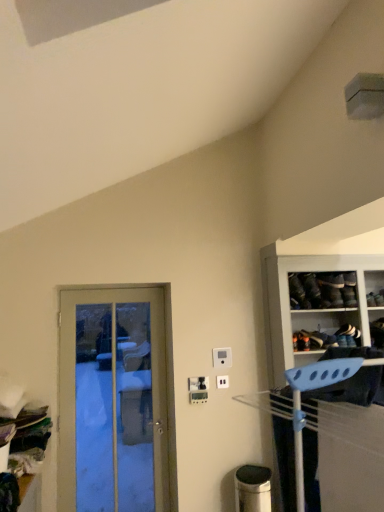
Question: Is white leather shoe at upper right, acting as the 1th shoe starting from the right, facing away from blue plastic hanger at right?

Choices:
 (A) yes
 (B) no

Answer: (B)

Question: Is white leather shoe at upper right, which is the first shoe from bottom to top, far from blue plastic hanger at right?

Choices:
 (A) yes
 (B) no

Answer: (B)

Question: Does white leather shoe at upper right, acting as the 1th shoe starting from the right, come behind blue plastic hanger at right?

Choices:
 (A) no
 (B) yes

Answer: (B)

Question: Is white leather shoe at upper right, acting as the 1th shoe starting from the right, with blue plastic hanger at right?

Choices:
 (A) yes
 (B) no

Answer: (B)

Question: From a real-world perspective, is white leather shoe at upper right, which is the 2th shoe in top-to-bottom order, physically below blue plastic hanger at right?

Choices:
 (A) no
 (B) yes

Answer: (A)

Question: In terms of height, does wooden door at left look taller or shorter compared to white plastic electric outlet at center, the first electric outlet from the top?

Choices:
 (A) tall
 (B) short

Answer: (A)

Question: From a real-world perspective, is wooden door at left above or below white plastic electric outlet at center, the first electric outlet from the top?

Choices:
 (A) above
 (B) below

Answer: (B)

Question: Is wooden door at left wider or thinner than white plastic electric outlet at center, which is the third electric outlet in bottom-to-top order?

Choices:
 (A) wide
 (B) thin

Answer: (A)

Question: From the image's perspective, is wooden door at left above or below white plastic electric outlet at center, which is the third electric outlet in bottom-to-top order?

Choices:
 (A) above
 (B) below

Answer: (B)

Question: Is point pyautogui.click(x=311, y=352) positioned closer to the camera than point pyautogui.click(x=201, y=388)?

Choices:
 (A) closer
 (B) farther

Answer: (A)

Question: Is blue plastic hanger at right wider or thinner than white plastic electric outlet at center, the 2th electric outlet positioned from the bottom?

Choices:
 (A) wide
 (B) thin

Answer: (A)

Question: Is blue plastic hanger at right situated inside white plastic electric outlet at center, the 2th electric outlet positioned from the bottom, or outside?

Choices:
 (A) outside
 (B) inside

Answer: (A)

Question: From a real-world perspective, is blue plastic hanger at right above or below white plastic electric outlet at center, the 2th electric outlet viewed from the top?

Choices:
 (A) above
 (B) below

Answer: (A)

Question: Relative to blue plastic hanger at right, is white plastic electric outlet at center, the 2th electric outlet positioned from the bottom, in front or behind?

Choices:
 (A) behind
 (B) front

Answer: (A)

Question: Is white plastic electric outlet at center, the 2th electric outlet viewed from the top, taller or shorter than blue plastic hanger at right?

Choices:
 (A) tall
 (B) short

Answer: (B)